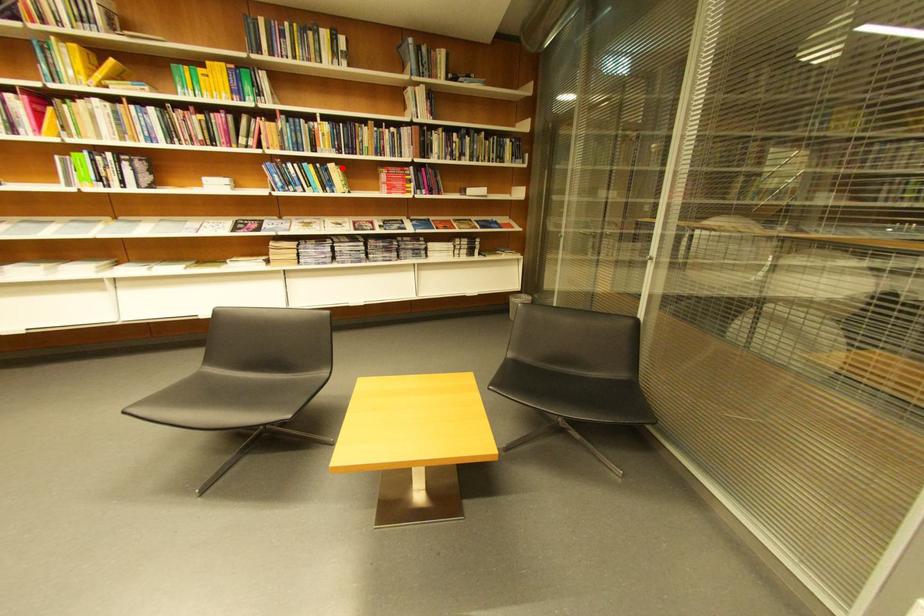
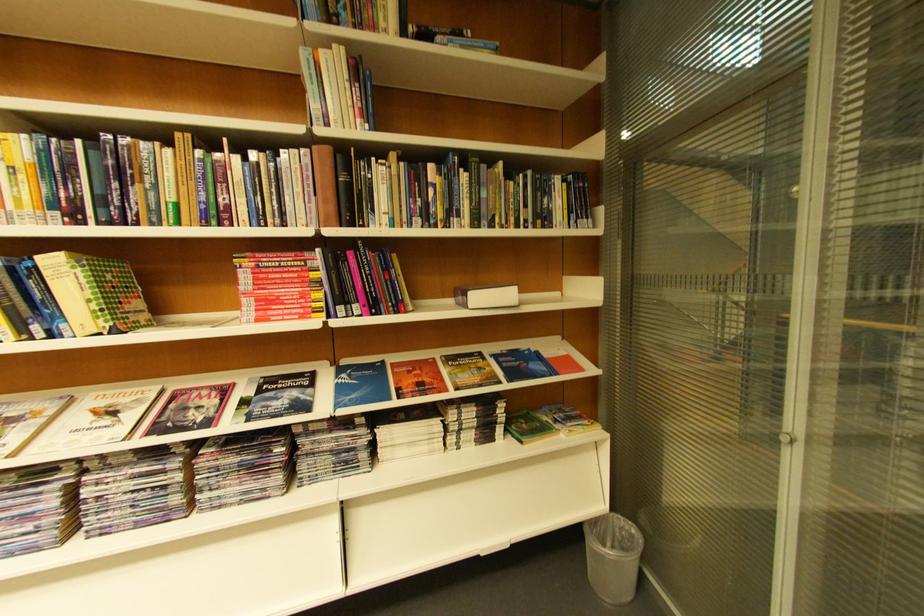
Question: I am providing you with two images of the same scene from different viewpoints. A red point is shown in image1. For the corresponding object point in image2, is it positioned nearer or farther from the camera?

Choices:
 (A) Nearer
 (B) Farther

Answer: (B)